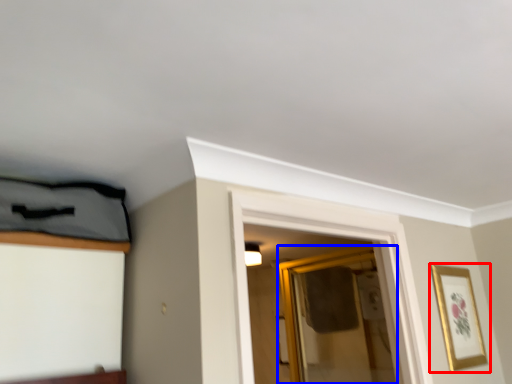
Question: Which object is further to the camera taking this photo, picture frame (highlighted by a red box) or glass door (highlighted by a blue box)?

Choices:
 (A) picture frame
 (B) glass door

Answer: (B)